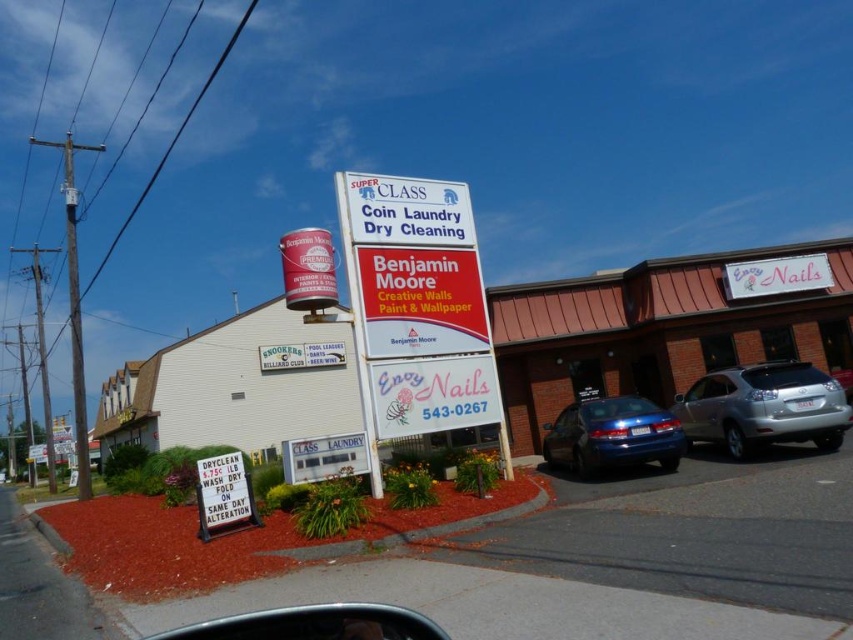
Question: Is silver metallic car at right above shiny blue sedan at center?

Choices:
 (A) yes
 (B) no

Answer: (A)

Question: Which object is closer to the camera taking this photo?

Choices:
 (A) white paper sign at lower left
 (B) metallic silver car at center

Answer: (A)

Question: In this image, where is red matte sign at center located relative to white paper sign at lower left?

Choices:
 (A) above
 (B) below

Answer: (A)

Question: Which point is farther to the camera?

Choices:
 (A) red matte sign at center
 (B) silver metallic car at right
 (C) white plastic sign at upper center
 (D) white glossy sign at upper right

Answer: (D)

Question: Considering the relative positions of shiny blue sedan at center and white paper sign at lower left in the image provided, where is shiny blue sedan at center located with respect to white paper sign at lower left?

Choices:
 (A) left
 (B) right

Answer: (B)

Question: Which point is closer to the camera?

Choices:
 (A) (393, 189)
 (B) (718, 406)
 (C) (491, 328)
 (D) (767, 291)

Answer: (A)